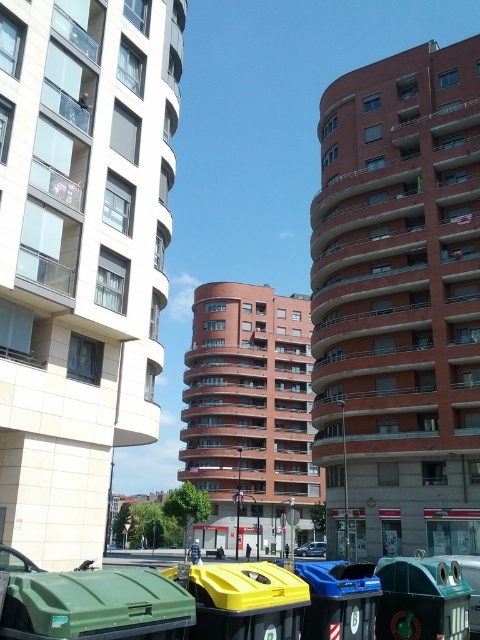
You are a waste collector who needs to determine which bin to empty first. You see a green plastic bin at lower left and a yellow plastic bin at lower center. Which bin is taller?

The green plastic bin at lower left is taller than the yellow plastic bin at lower center, so you should empty the green plastic bin at lower left first.

You are a waste collector who needs to collect both the yellow plastic bin at lower center and the green plastic recycling bin at lower right. Which bin should you collect first if you are approaching from the left side of the scene?

The yellow plastic bin at lower center should be collected first because it is positioned on the left side of the green plastic recycling bin at lower right, making it closer to your approach direction from the left.

You are standing at the camera position and want to place a yellow plastic bin at lower center. The bin is 1.2 meters wide. Is there enough space between you and the bin to walk comfortably?

The distance between you and the yellow plastic bin at lower center is 6.49 meters, which is more than enough space to walk comfortably since the bin itself is only 1.2 meters wide.